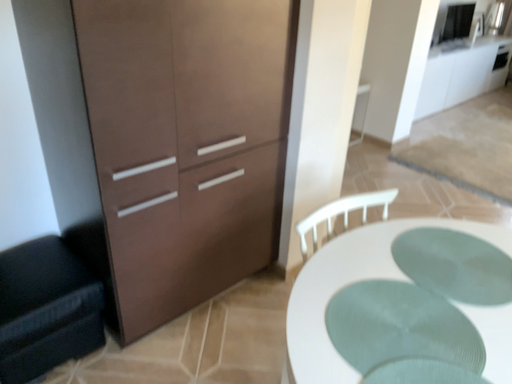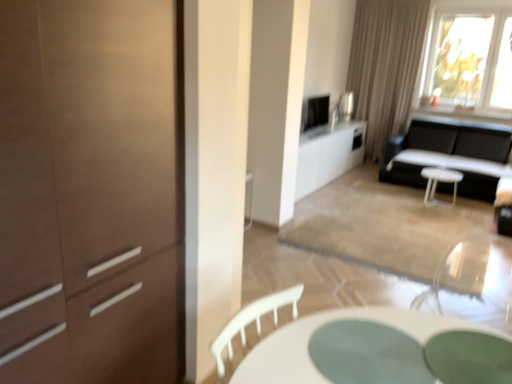
Question: Which way did the camera rotate in the video?

Choices:
 (A) rotated upward
 (B) rotated downward

Answer: (A)